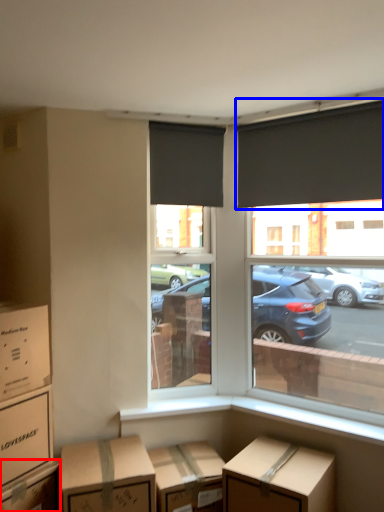
Question: Which object is further to the camera taking this photo, box (highlighted by a red box) or window blind (highlighted by a blue box)?

Choices:
 (A) box
 (B) window blind

Answer: (B)